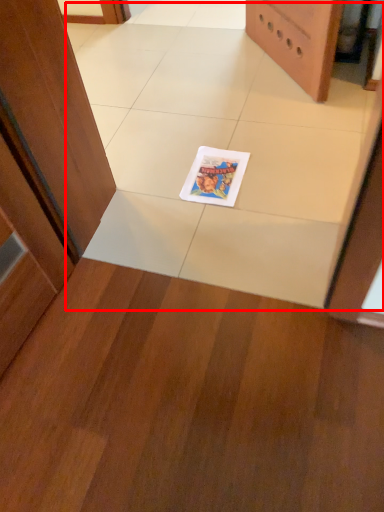
Question: From the image's perspective, where is ceramic tile (annotated by the red box) located in relation to comic book in the image?

Choices:
 (A) below
 (B) above

Answer: (B)